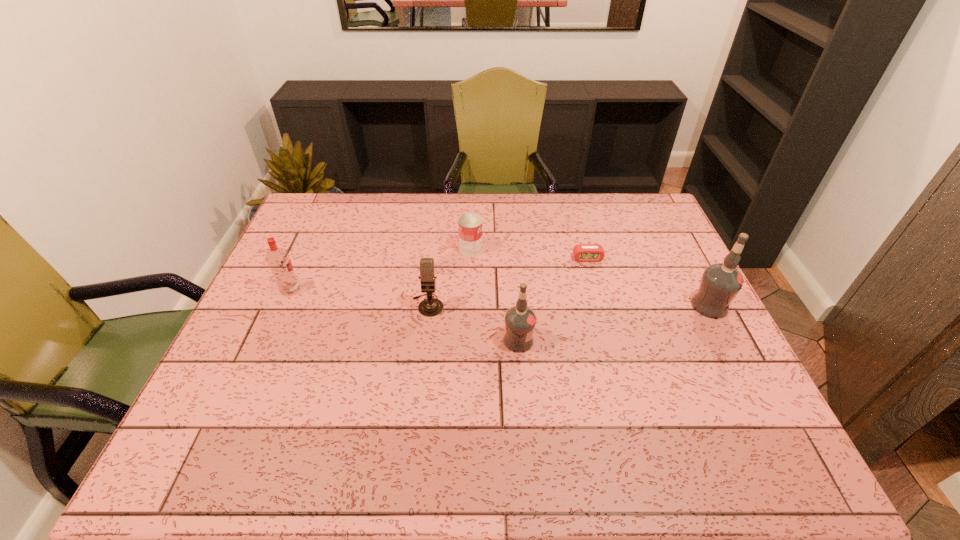
You are a GUI agent. You are given a task and a screenshot of the screen. Output one action in this format:
    pyautogui.click(x=<x>, y=<y>)
    Task: Click on the vacant space at the right edge of the desktop
    
    Given the screenshot: What is the action you would take?
    740,375

You are a GUI agent. You are given a task and a screenshot of the screen. Output one action in this format:
    pyautogui.click(x=<x>, y=<y>)
    Task: Click on the free space at the far left corner of the desktop
    
    Given the screenshot: What is the action you would take?
    pyautogui.click(x=308, y=212)

At what (x,y) coordinates should I click in order to perform the action: click on vacant space at the far right corner. Please return your answer as a coordinate pair (x, y). Image resolution: width=960 pixels, height=540 pixels. Looking at the image, I should click on (628, 193).

Image resolution: width=960 pixels, height=540 pixels. In order to click on vacant space at the near right corner in this screenshot , I will do `click(706, 421)`.

You are a GUI agent. You are given a task and a screenshot of the screen. Output one action in this format:
    pyautogui.click(x=<x>, y=<y>)
    Task: Click on the empty space between the fourth object from right to left and the nearest vodka
    This screenshot has height=540, width=960.
    Given the screenshot: What is the action you would take?
    pyautogui.click(x=494, y=295)

You are a GUI agent. You are given a task and a screenshot of the screen. Output one action in this format:
    pyautogui.click(x=<x>, y=<y>)
    Task: Click on the vacant region between the leftmost vodka and the microphone
    The image size is (960, 540).
    Given the screenshot: What is the action you would take?
    pyautogui.click(x=359, y=298)

I want to click on free space between the alarm clock and the leftmost vodka, so click(439, 274).

Identify the location of unoccupied position between the nearest object and the rightmost object. (614, 323).

Where is `vacant area between the fourth object from right to left and the shortest object`? This screenshot has height=540, width=960. vacant area between the fourth object from right to left and the shortest object is located at coordinates (529, 254).

Find the location of `vacant area between the can and the second vodka from right to left`. vacant area between the can and the second vodka from right to left is located at coordinates (494, 295).